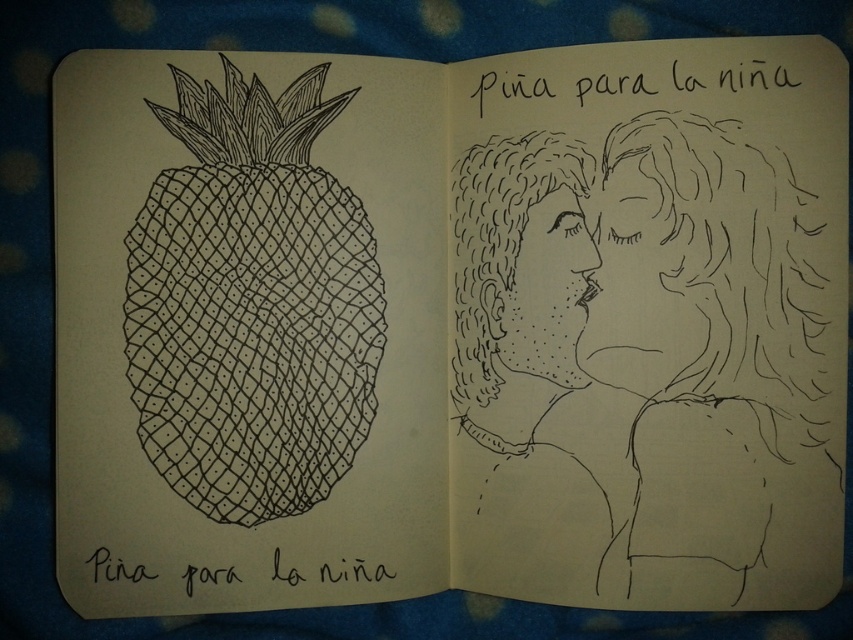
You are an artist who wants to add a new drawing between the black ink couple at center and the black ink pineapple at left in the open sketchbook. Based on their positions, where should you place the new drawing?

Since the black ink couple at center is closer to the viewer than the black ink pineapple at left, you should place the new drawing between them by positioning it closer to the black ink pineapple at left to maintain the spatial relationship.

You are standing at the point labeled as point (763, 356) in the image. The sketchbook is placed on a blue fabric background with light circles. You want to reach the edge of the sketchbook to pick it up. Considering your current position, can you estimate how far you need to move to reach the edge?

The point labeled point (763, 356) is 36.42 inches away from the viewer. To reach the edge of the sketchbook, you would need to move approximately 36.42 inches forward from your current position.

You are an artist trying to place a new sticker on your sketchbook. The sticker is 3 cm in diameter. You want to place it near the black ink couple at center without overlapping them. Where should you place the sticker?

The sticker should be placed 3 cm away from the black ink couple at center, ensuring it does not overlap. Since the couple is at point [637,355], placing the sticker slightly to the left or right, or above or below this coordinate would work, as long as it maintains the required distance.